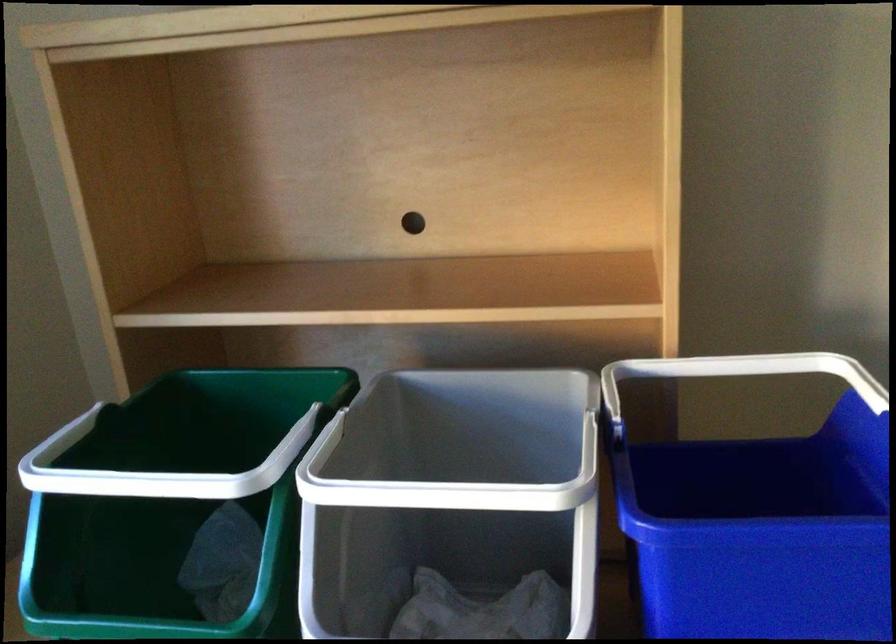
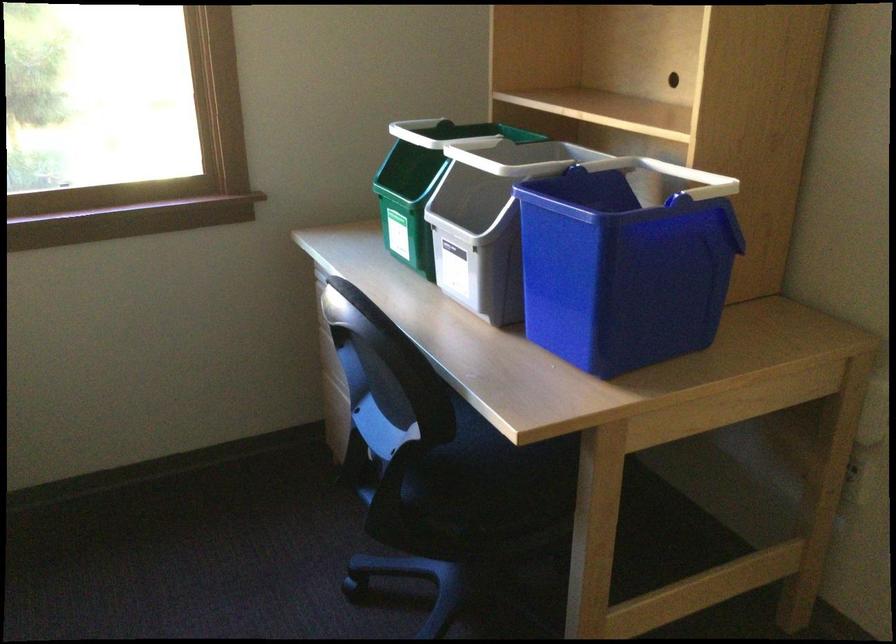
The point at (350, 545) is marked in the first image. Where is the corresponding point in the second image?

(479, 201)